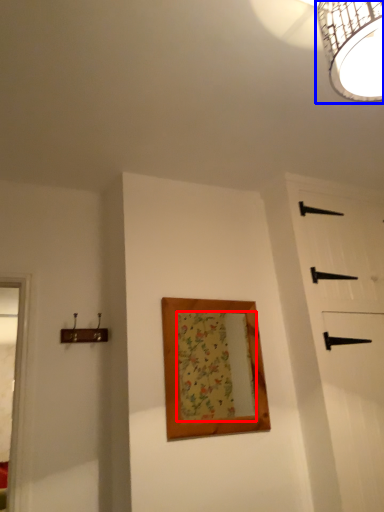
Question: Which object is closer to the camera taking this photo, mirror (highlighted by a red box) or lamp (highlighted by a blue box)?

Choices:
 (A) mirror
 (B) lamp

Answer: (B)